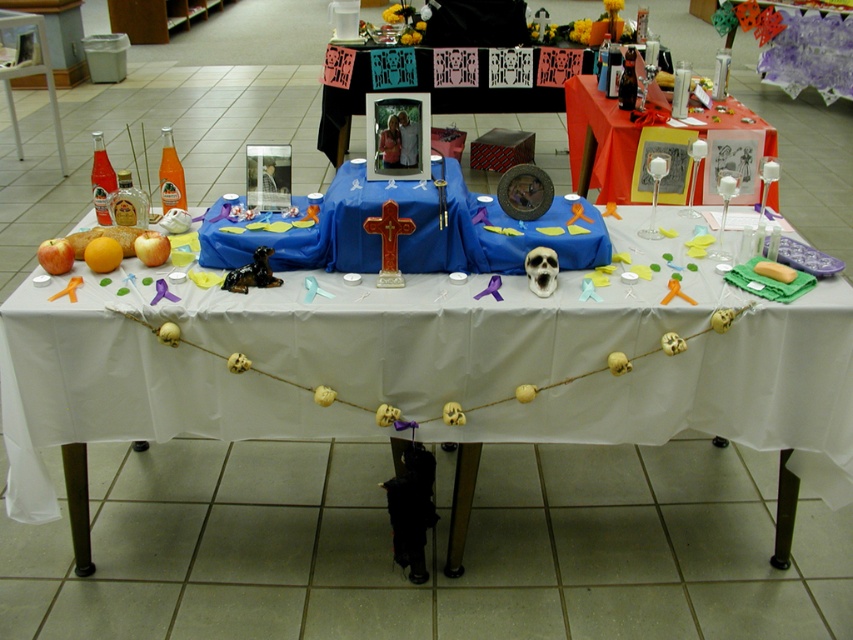
Is white fabric table at center wider than translucent glass candlesticks at upper right?

Yes, white fabric table at center is wider than translucent glass candlesticks at upper right.

Is point (704, 396) positioned after point (567, 113)?

No, it is not.

Between point (718, 396) and point (566, 106), which one is positioned behind?

Positioned behind is point (566, 106).

This screenshot has width=853, height=640. I want to click on white fabric table at center, so click(422, 372).

Who is higher up, white fabric table at center or matte black frame at upper center?

Positioned higher is matte black frame at upper center.

Is white fabric table at center positioned in front of matte black frame at upper center?

That is True.

This screenshot has height=640, width=853. I want to click on white fabric table at center, so click(x=422, y=372).

Find the location of `matte black frame at upper center`. matte black frame at upper center is located at coordinates (485, 90).

Does matte black frame at upper center have a larger size compared to translucent glass candlesticks at upper right?

Actually, matte black frame at upper center might be smaller than translucent glass candlesticks at upper right.

The image size is (853, 640). What do you see at coordinates (485, 90) in the screenshot?
I see `matte black frame at upper center` at bounding box center [485, 90].

The image size is (853, 640). Find the location of `matte black frame at upper center`. matte black frame at upper center is located at coordinates (485, 90).